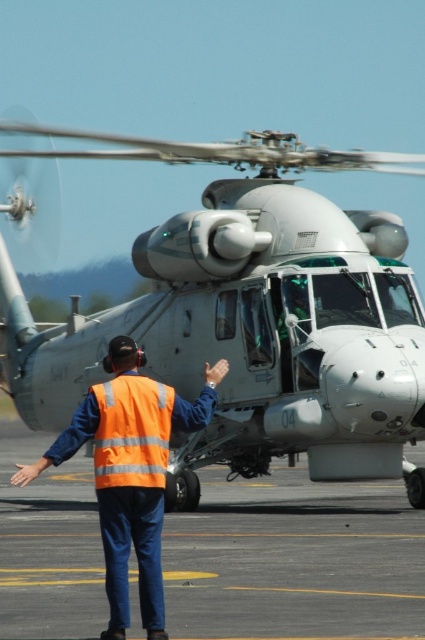
Is gray asphalt tarmac at center shorter than orange reflective safety vest at center?

In fact, gray asphalt tarmac at center may be taller than orange reflective safety vest at center.

In order to click on gray asphalt tarmac at center in this screenshot , I will do `click(294, 561)`.

The image size is (425, 640). I want to click on gray asphalt tarmac at center, so (x=294, y=561).

Looking at this image, is gray metallic helicopter at center smaller than orange reflective safety vest at center?

Incorrect, gray metallic helicopter at center is not smaller in size than orange reflective safety vest at center.

Between gray metallic helicopter at center and orange reflective safety vest at center, which one has less height?

orange reflective safety vest at center

Is point (200, 160) positioned after point (136, 449)?

Yes, it is behind point (136, 449).

Where is `gray metallic helicopter at center`? gray metallic helicopter at center is located at coordinates (249, 317).

Which is above, orange reflective vest at center or orange reflective safety vest at center?

orange reflective safety vest at center is above.

Does point (153, 621) lie behind point (101, 404)?

No, (153, 621) is closer to viewer.

In order to click on orange reflective vest at center in this screenshot , I will do `click(130, 472)`.